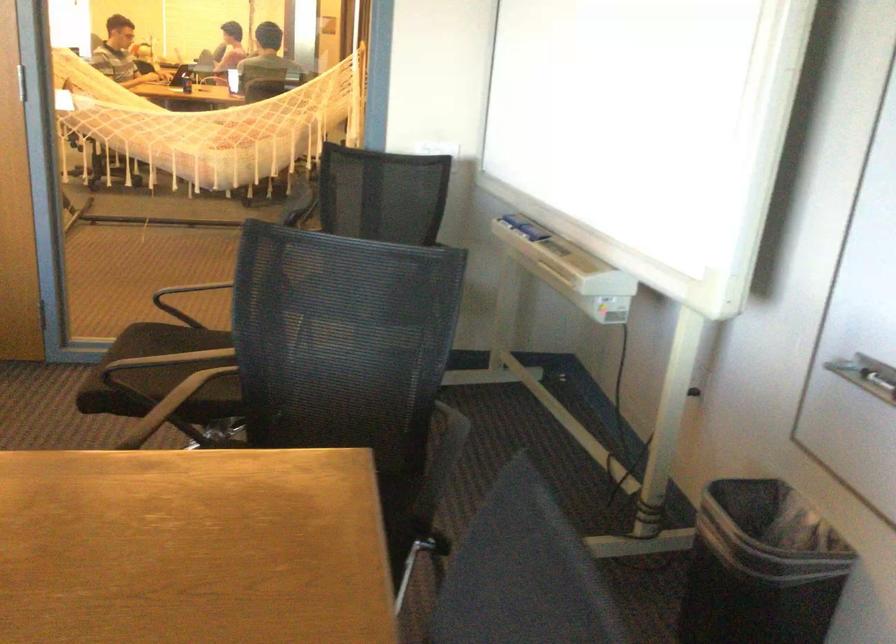
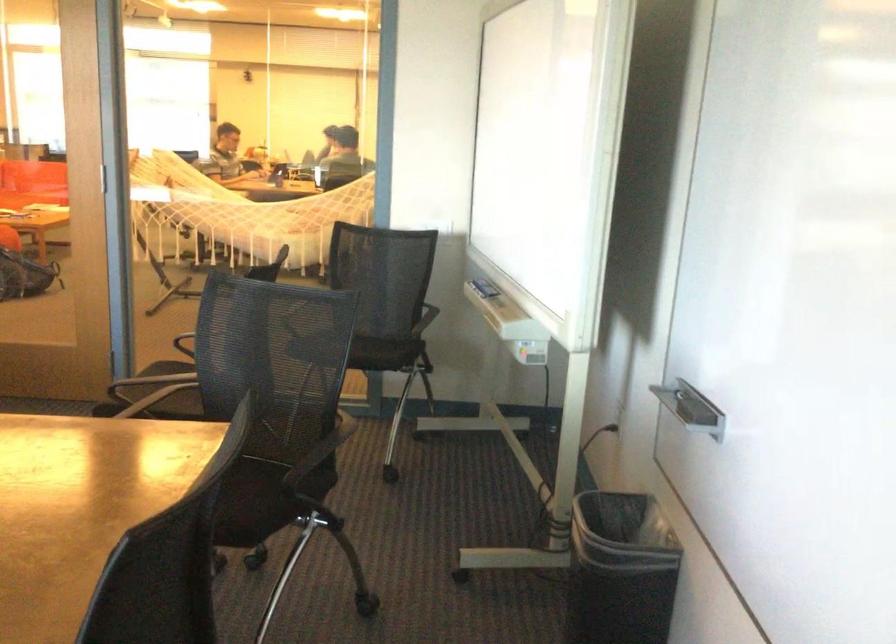
In the second image, find the point that corresponds to [530,228] in the first image.

(484, 288)